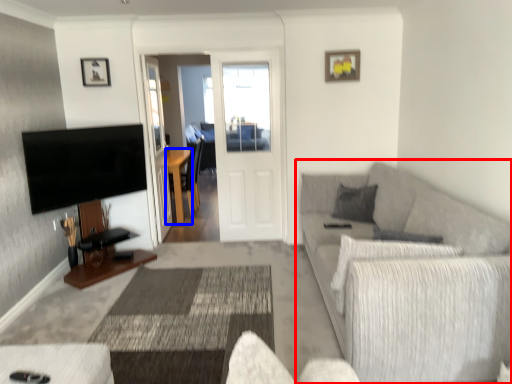
Question: Which of the following is the closest to the observer, studio couch (highlighted by a red box) or table (highlighted by a blue box)?

Choices:
 (A) studio couch
 (B) table

Answer: (A)